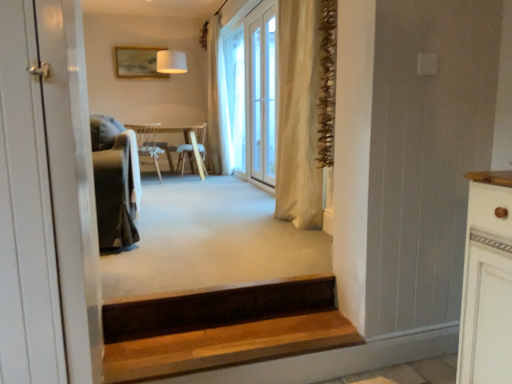
Question: Does velvet green armchair at left turn towards beige fabric curtain at center, placed as the 2th curtain when sorted from left to right?

Choices:
 (A) no
 (B) yes

Answer: (A)

Question: Considering the relative sizes of velvet green armchair at left and beige fabric curtain at center, placed as the 2th curtain when sorted from left to right, in the image provided, is velvet green armchair at left wider than beige fabric curtain at center, placed as the 2th curtain when sorted from left to right,?

Choices:
 (A) no
 (B) yes

Answer: (B)

Question: Considering the relative sizes of velvet green armchair at left and beige fabric curtain at center, placed as the 2th curtain when sorted from left to right, in the image provided, is velvet green armchair at left taller than beige fabric curtain at center, placed as the 2th curtain when sorted from left to right,?

Choices:
 (A) no
 (B) yes

Answer: (A)

Question: Is velvet green armchair at left turned away from beige fabric curtain at center, the first curtain in the front-to-back sequence?

Choices:
 (A) no
 (B) yes

Answer: (B)

Question: Is velvet green armchair at left not inside beige fabric curtain at center, placed as the 2th curtain when sorted from left to right?

Choices:
 (A) no
 (B) yes

Answer: (B)

Question: From a real-world perspective, does velvet green armchair at left sit lower than beige fabric curtain at center, the first curtain in the front-to-back sequence?

Choices:
 (A) no
 (B) yes

Answer: (B)

Question: From a real-world perspective, does wooden stairs at lower center stand above white wood door at left?

Choices:
 (A) no
 (B) yes

Answer: (A)

Question: From the image's perspective, does wooden stairs at lower center appear lower than white wood door at left?

Choices:
 (A) yes
 (B) no

Answer: (A)

Question: Can you confirm if wooden stairs at lower center is taller than white wood door at left?

Choices:
 (A) yes
 (B) no

Answer: (B)

Question: Is white wood door at left a part of wooden stairs at lower center?

Choices:
 (A) yes
 (B) no

Answer: (B)

Question: Is wooden stairs at lower center turned away from white wood door at left?

Choices:
 (A) yes
 (B) no

Answer: (B)

Question: Can you confirm if wooden stairs at lower center is positioned to the right of white wood door at left?

Choices:
 (A) yes
 (B) no

Answer: (A)

Question: Is wooden chair at center, which appears as the second chair when viewed from the back, outside of beige fabric curtain at center, the first curtain in the front-to-back sequence?

Choices:
 (A) no
 (B) yes

Answer: (B)